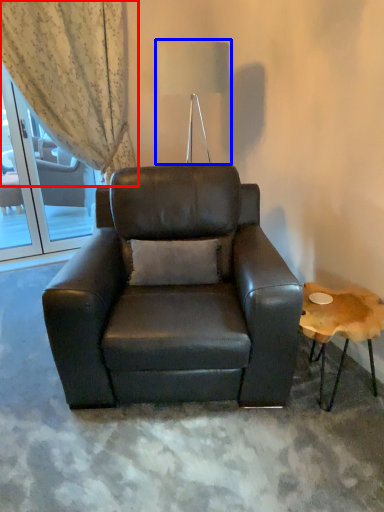
Question: Which object is further to the camera taking this photo, curtain (highlighted by a red box) or table lamp (highlighted by a blue box)?

Choices:
 (A) curtain
 (B) table lamp

Answer: (A)